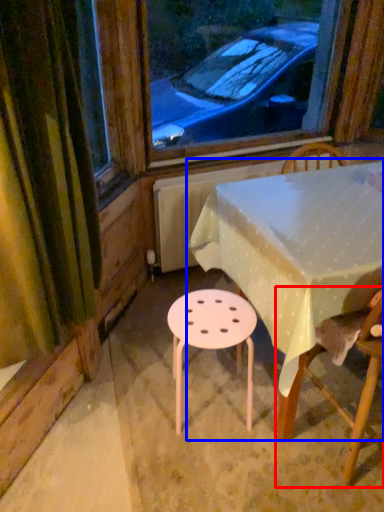
Question: Among these objects, which one is nearest to the camera, chair (highlighted by a red box) or table (highlighted by a blue box)?

Choices:
 (A) chair
 (B) table

Answer: (A)